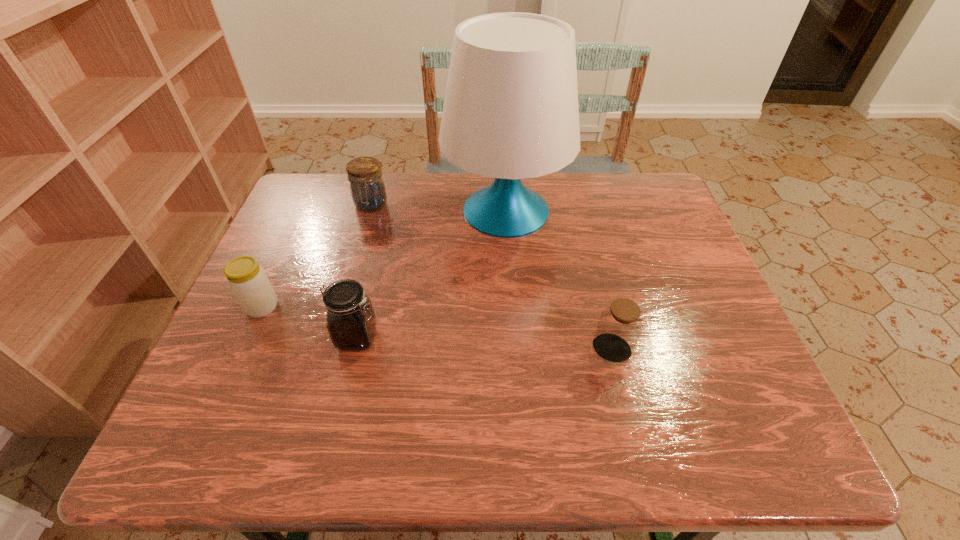
The image size is (960, 540). I want to click on the tallest object, so click(510, 112).

In order to click on the farthest jar in this screenshot , I will do `click(367, 187)`.

This screenshot has height=540, width=960. I want to click on the second farthest jar, so click(x=248, y=281).

At what (x,y) coordinates should I click in order to perform the action: click on the leftmost object. Please return your answer as a coordinate pair (x, y). The image size is (960, 540). Looking at the image, I should click on (248, 281).

Where is `the rightmost jar`? Image resolution: width=960 pixels, height=540 pixels. the rightmost jar is located at coordinates (620, 324).

Where is `vacant region located on the front-facing side of the table lamp`? vacant region located on the front-facing side of the table lamp is located at coordinates (399, 211).

Where is `vacant space located 0.170m on the front-facing side of the table lamp`? vacant space located 0.170m on the front-facing side of the table lamp is located at coordinates (386, 211).

I want to click on vacant region located on the front-facing side of the table lamp, so click(423, 211).

Image resolution: width=960 pixels, height=540 pixels. What are the coordinates of `vacant space located on the lid of the farthest jar` in the screenshot? It's located at (349, 280).

This screenshot has height=540, width=960. I want to click on vacant area situated 0.200m on the right of the leftmost jar, so click(x=363, y=307).